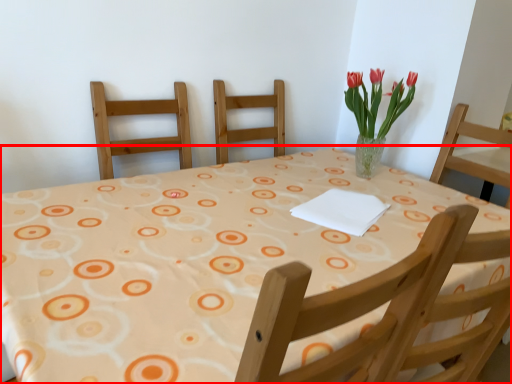
Question: Where is table (annotated by the red box) located in relation to floral arrangement in the image?

Choices:
 (A) left
 (B) right

Answer: (A)